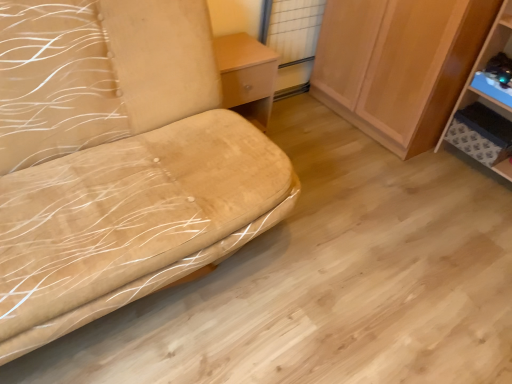
Locate an element on the screen. vacant space that is in between light wood/texture table at center and wooden cabinet at right is located at coordinates (319, 136).